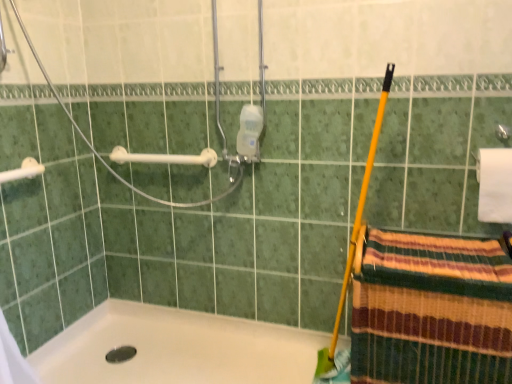
Question: Is white plastic towel bar at upper left, which is counted as the 1th towel bar, starting from the left, oriented away from striped woven towel at lower right?

Choices:
 (A) yes
 (B) no

Answer: (B)

Question: Does white plastic towel bar at upper left, positioned as the second towel bar in back-to-front order, have a smaller size compared to striped woven towel at lower right?

Choices:
 (A) yes
 (B) no

Answer: (A)

Question: Can you confirm if white plastic towel bar at upper left, which is counted as the 1th towel bar, starting from the left, is shorter than striped woven towel at lower right?

Choices:
 (A) yes
 (B) no

Answer: (A)

Question: Is white plastic towel bar at upper left, placed as the second towel bar when sorted from right to left, positioned behind striped woven towel at lower right?

Choices:
 (A) no
 (B) yes

Answer: (B)

Question: From a real-world perspective, does white plastic towel bar at upper left, placed as the second towel bar when sorted from right to left, stand above striped woven towel at lower right?

Choices:
 (A) no
 (B) yes

Answer: (B)

Question: From the image's perspective, is white plastic towel bar at upper left, the 1th towel bar in the right-to-left sequence, positioned above or below white matte toilet paper at upper right?

Choices:
 (A) above
 (B) below

Answer: (A)

Question: Is point (192, 163) closer or farther from the camera than point (498, 150)?

Choices:
 (A) closer
 (B) farther

Answer: (B)

Question: Is white plastic towel bar at upper left, the second towel bar viewed from the front, spatially inside white matte toilet paper at upper right, or outside of it?

Choices:
 (A) outside
 (B) inside

Answer: (A)

Question: Is white plastic towel bar at upper left, the 1th towel bar in the right-to-left sequence, to the left or to the right of white matte toilet paper at upper right in the image?

Choices:
 (A) right
 (B) left

Answer: (B)

Question: Is striped woven towel at lower right wider or thinner than white plastic shower at upper left?

Choices:
 (A) wide
 (B) thin

Answer: (B)

Question: From the image's perspective, is striped woven towel at lower right above or below white plastic shower at upper left?

Choices:
 (A) above
 (B) below

Answer: (B)

Question: In terms of size, does striped woven towel at lower right appear bigger or smaller than white plastic shower at upper left?

Choices:
 (A) big
 (B) small

Answer: (B)

Question: Is point (456, 332) positioned closer to the camera than point (49, 77)?

Choices:
 (A) closer
 (B) farther

Answer: (A)

Question: Would you say striped woven towel at lower right is to the left or to the right of white plastic towel bar at upper left, placed as the second towel bar when sorted from right to left, in the picture?

Choices:
 (A) right
 (B) left

Answer: (A)

Question: Choose the correct answer: Is striped woven towel at lower right inside white plastic towel bar at upper left, positioned as the second towel bar in back-to-front order, or outside it?

Choices:
 (A) outside
 (B) inside

Answer: (A)